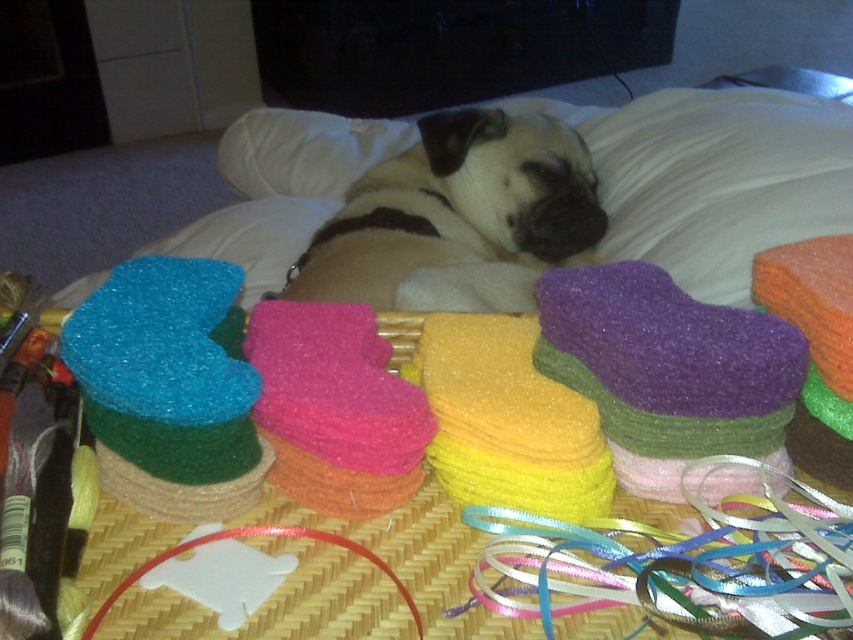
You are a visitor in the room and want to know which object is larger between the matte beige dog at center and the blue glittery heart at left. Can you tell me?

The matte beige dog at center is bigger than the blue glittery heart at left.